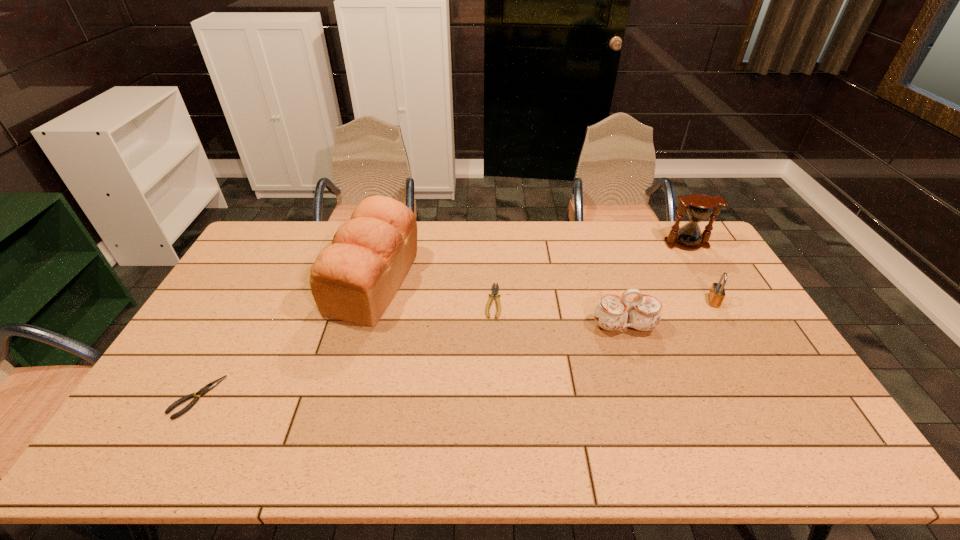
You are a GUI agent. You are given a task and a screenshot of the screen. Output one action in this format:
    pyautogui.click(x=<x>, y=<y>)
    Task: Click on the free location located on the front of the bread
    This screenshot has width=960, height=540.
    Given the screenshot: What is the action you would take?
    pyautogui.click(x=343, y=398)

Identify the location of free space located 0.220m on the front of the fifth shortest object. The height and width of the screenshot is (540, 960). (715, 293).

This screenshot has height=540, width=960. Find the location of `free space located by the handle of the third object from right to left`. free space located by the handle of the third object from right to left is located at coordinates (664, 448).

I want to click on free location located on the left of the fourth tallest object, so [654, 301].

Locate an element on the screen. Image resolution: width=960 pixels, height=540 pixels. free space located 0.170m on the right of the nearer pliers is located at coordinates (282, 397).

Identify the location of vacant position located on the back of the right pliers. (491, 224).

You are a GUI agent. You are given a task and a screenshot of the screen. Output one action in this format:
    pyautogui.click(x=<x>, y=<y>)
    Task: Click on the bread located at the far edge
    
    Given the screenshot: What is the action you would take?
    pyautogui.click(x=354, y=280)

Where is `hourglass located at the far edge`? Image resolution: width=960 pixels, height=540 pixels. hourglass located at the far edge is located at coordinates (699, 207).

Image resolution: width=960 pixels, height=540 pixels. What are the coordinates of `object at the left edge` in the screenshot? It's located at 210,386.

The height and width of the screenshot is (540, 960). I want to click on hourglass located in the right edge section of the desktop, so click(699, 207).